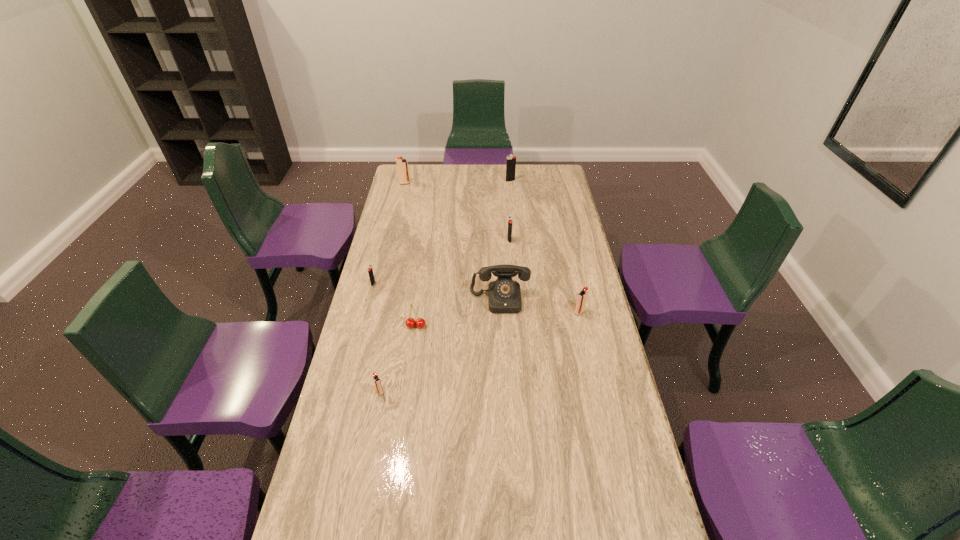
This screenshot has height=540, width=960. Find the location of `free space between the smallest black igniter and the biggest black igniter`. free space between the smallest black igniter and the biggest black igniter is located at coordinates (442, 232).

I want to click on vacant space that is in between the second nearest black igniter and the farthest black igniter, so click(x=510, y=211).

Identify the location of free space that is in between the second red igniter from right to left and the farthest black igniter. pos(445,286).

At what (x,y) coordinates should I click in order to perform the action: click on vacant point located between the gray telephone and the biggest black igniter. Please return your answer as a coordinate pair (x, y). Looking at the image, I should click on (505, 240).

Locate an element on the screen. Image resolution: width=960 pixels, height=540 pixels. object that ranks as the sixth closest to the nearest red igniter is located at coordinates (402, 164).

The height and width of the screenshot is (540, 960). Find the location of `object that can be found as the fifth closest to the fourth farthest igniter`. object that can be found as the fifth closest to the fourth farthest igniter is located at coordinates (402, 164).

Find the location of a particular element. This screenshot has width=960, height=540. igniter that is the second nearest to the telephone is located at coordinates (509, 235).

Where is `igniter that is the nearest to the third nearest igniter`? igniter that is the nearest to the third nearest igniter is located at coordinates (378, 386).

The image size is (960, 540). Identify the location of red igniter that is the closest to the nearest object. (582, 296).

Locate an element on the screen. This screenshot has width=960, height=540. red igniter object that ranks as the second closest to the cherry is located at coordinates (582, 296).